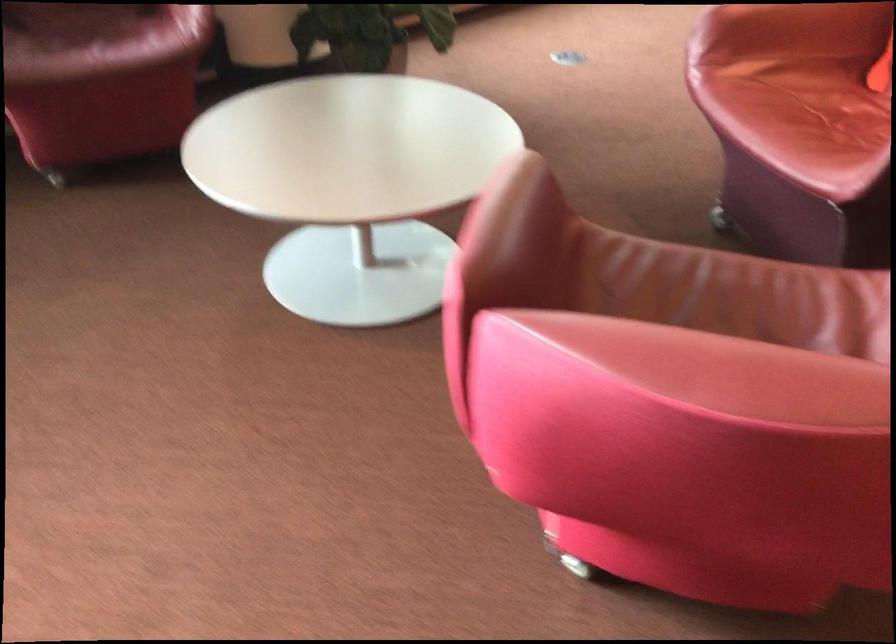
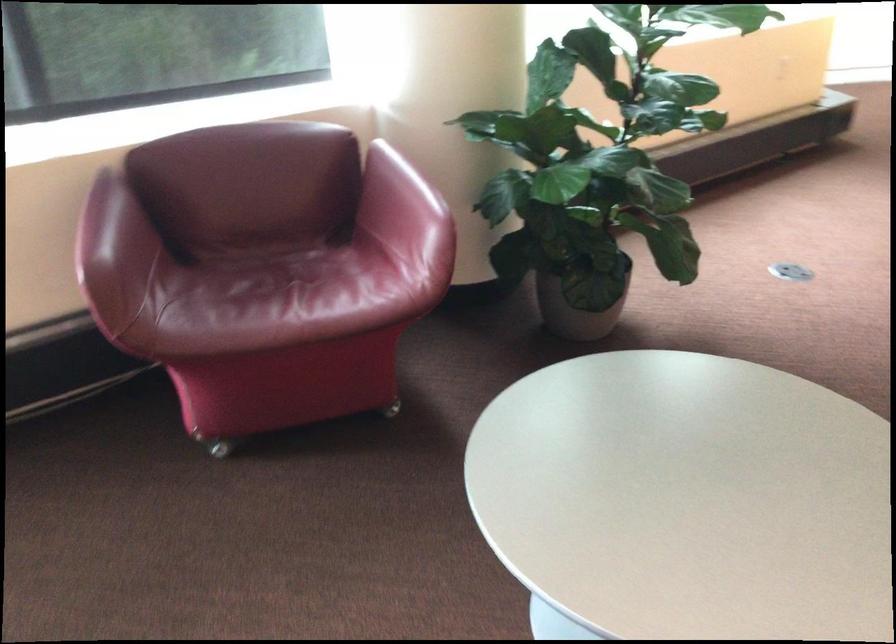
What movement of the cameraman would produce the second image?

The movement direction of the cameraman is left, forward.